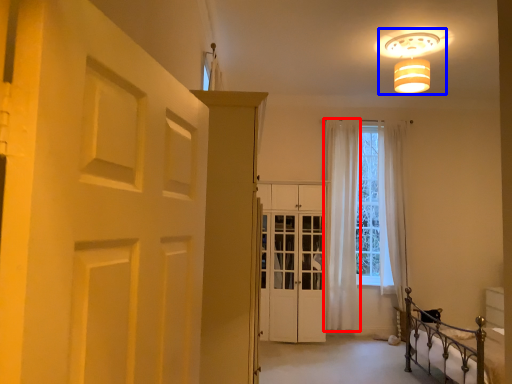
Question: Among these objects, which one is nearest to the camera, curtain (highlighted by a red box) or lamp (highlighted by a blue box)?

Choices:
 (A) curtain
 (B) lamp

Answer: (B)